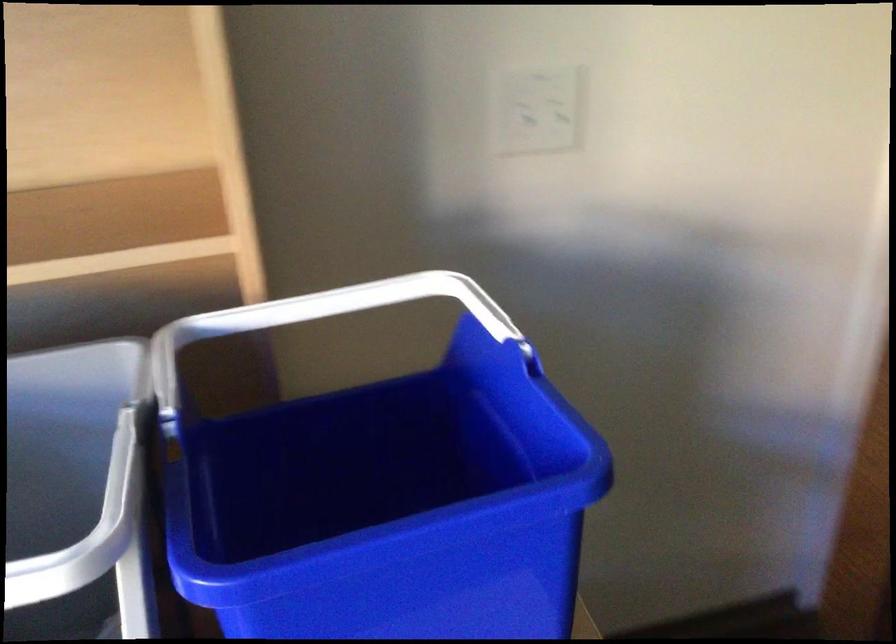
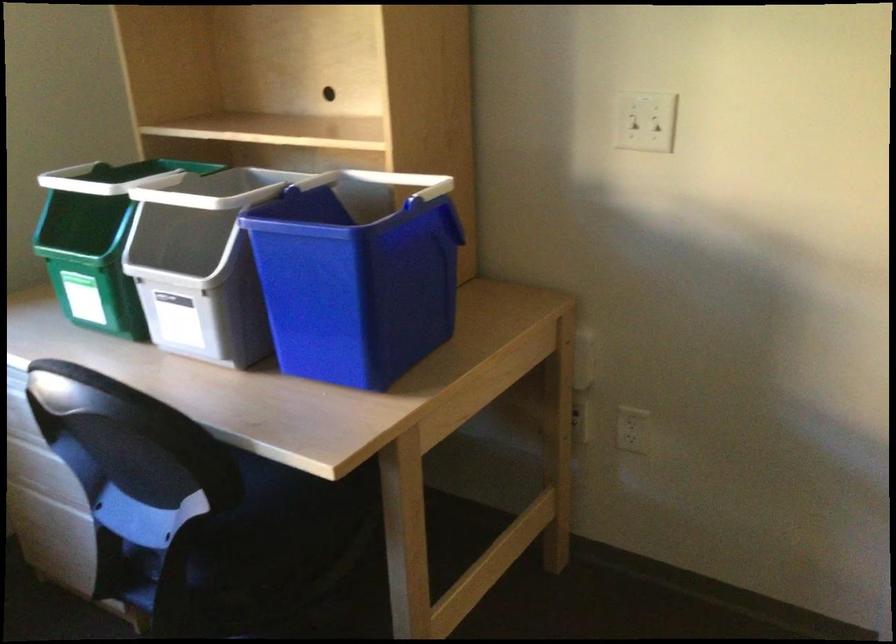
Locate, in the second image, the point that corresponds to the point at 524,102 in the first image.

(643, 118)